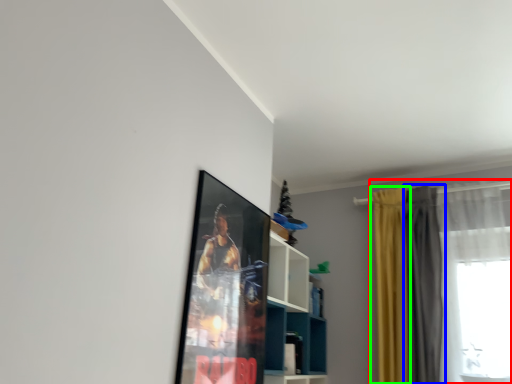
Question: Which is nearer to the curtain (highlighted by a red box)? curtain (highlighted by a blue box) or curtain (highlighted by a green box).

Choices:
 (A) curtain
 (B) curtain

Answer: (A)